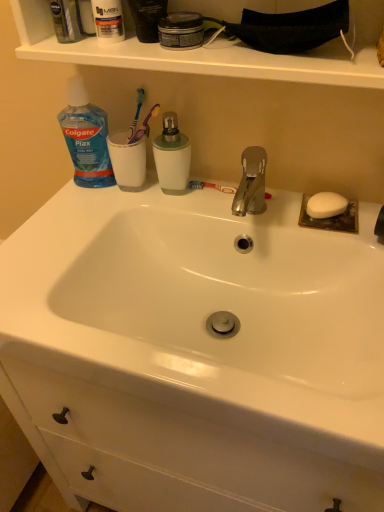
Where is `vacant space in front of blue plastic toothbrush at upper center`? Image resolution: width=384 pixels, height=512 pixels. vacant space in front of blue plastic toothbrush at upper center is located at coordinates (127, 202).